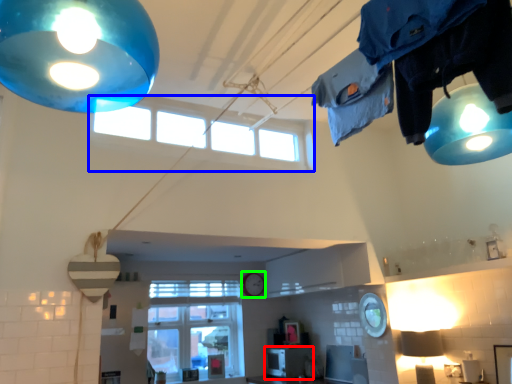
Question: Based on their relative distances, which object is farther from appliance (highlighted by a red box)? Choose from window (highlighted by a blue box) and clock (highlighted by a green box).

Choices:
 (A) window
 (B) clock

Answer: (A)